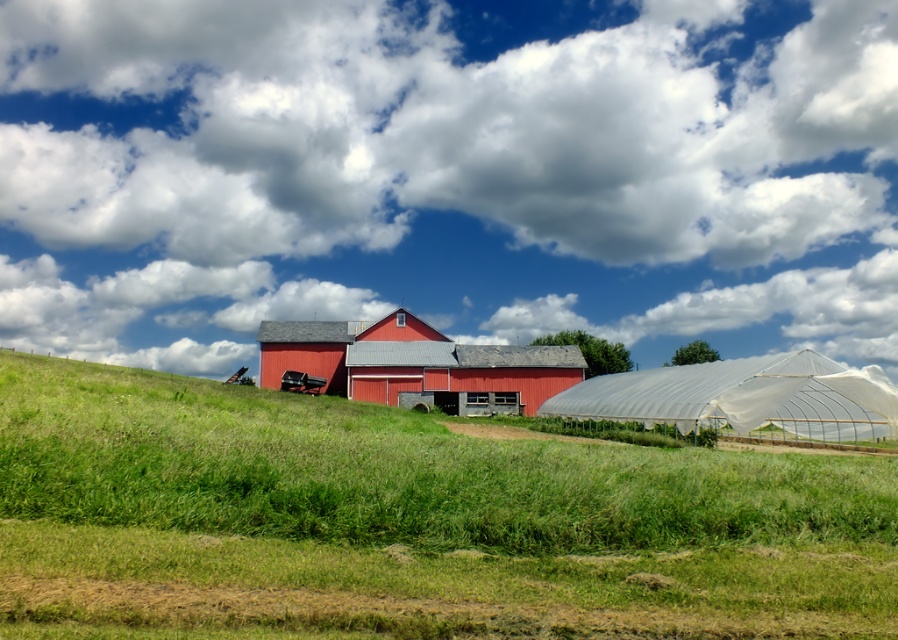
You are standing at the center of the image and want to walk towards the green grassy field at lower center. According to the coordinates provided, in which direction should you move?

The green grassy field at lower center is located at point coordinates, so you should move downward from the center to reach it.

You are standing at the edge of the green grassy field at lower center and want to walk towards the matte red barn at center. Which direction should you move relative to the barn?

Since the green grassy field at lower center is to the right of the matte red barn at center, you should move to the left to reach the barn from the field.

You are standing at the bottom of the hill looking up towards the barn. Which object is closer to you, the green grassy field at lower center or the matte red barn at center?

The green grassy field at lower center is closer to you because it is located below the matte red barn at center.